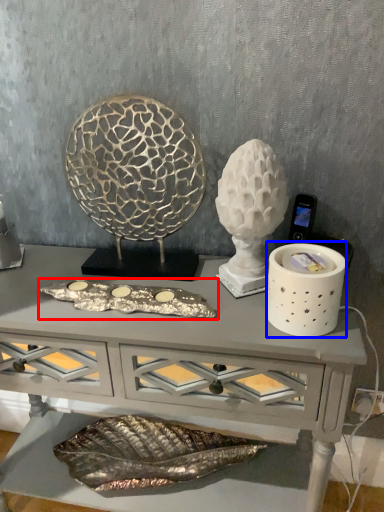
Question: Which object is further to the camera taking this photo, art (highlighted by a red box) or candle holder (highlighted by a blue box)?

Choices:
 (A) art
 (B) candle holder

Answer: (A)